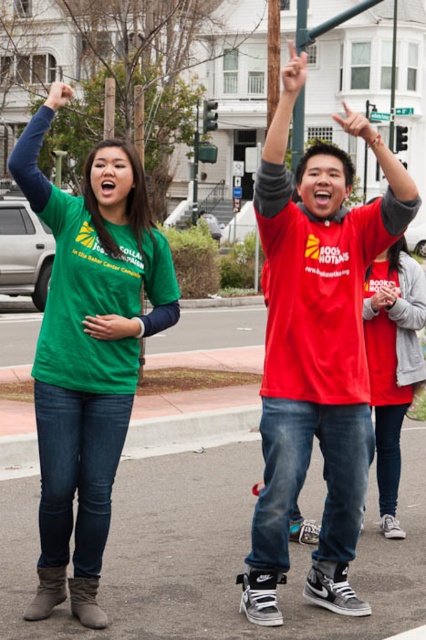
Question: Which point appears closest to the camera in this image?

Choices:
 (A) (391, 429)
 (B) (299, 60)

Answer: (B)

Question: Does matte red shirt at upper right appear on the right side of matte red shirt at center?

Choices:
 (A) yes
 (B) no

Answer: (B)

Question: Can you confirm if matte red shirt at upper right is positioned above green matte t-shirt at left?

Choices:
 (A) yes
 (B) no

Answer: (A)

Question: Which of these objects is positioned farthest from the matte red shirt at center?

Choices:
 (A) matte red shirt at upper right
 (B) green matte t-shirt at left

Answer: (B)

Question: Which point is farther from the camera taking this photo?

Choices:
 (A) (394, 371)
 (B) (57, 432)
 (C) (284, 144)

Answer: (A)

Question: In this image, where is green matte t-shirt at left located relative to matte red shirt at center?

Choices:
 (A) left
 (B) right

Answer: (A)